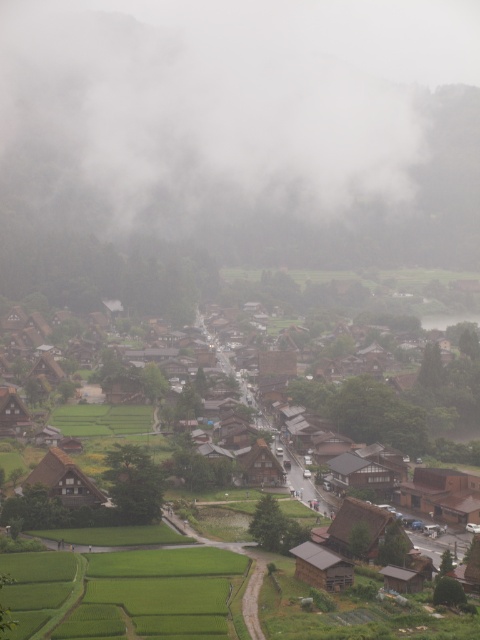
Question: Can you confirm if brown wooden house at lower left is thinner than brown wooden hut at lower left?

Choices:
 (A) yes
 (B) no

Answer: (B)

Question: From the image, what is the correct spatial relationship of brown wooden hut at lower right in relation to brown wooden hut at lower left?

Choices:
 (A) below
 (B) above

Answer: (A)

Question: Estimate the real-world distances between objects in this image. Which object is closer to the brown wooden hut at lower right?

Choices:
 (A) brown wooden houses at center
 (B) brown wooden house at lower left

Answer: (B)

Question: Which point is farther to the camera?

Choices:
 (A) (0, 403)
 (B) (371, 488)

Answer: (A)

Question: Based on their relative distances, which object is farther from the brown wooden hut at lower right?

Choices:
 (A) brown wooden houses at center
 (B) brown wooden hut at center
 (C) dark brown wooden hut at center

Answer: (B)

Question: Can you confirm if brown wooden houses at center is bigger than brown thatched roof hut at center?

Choices:
 (A) no
 (B) yes

Answer: (B)